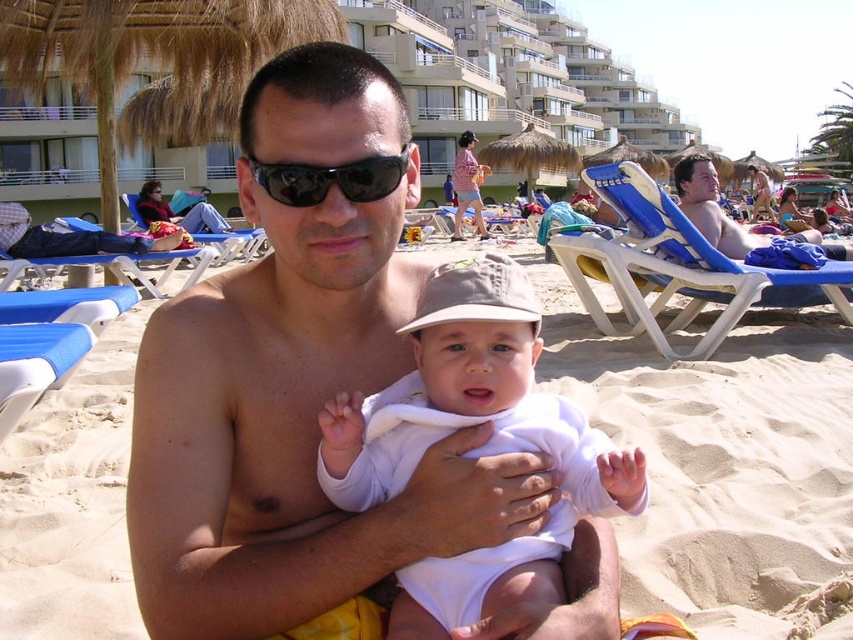
Question: Which point appears farthest from the camera in this image?

Choices:
 (A) (718, 180)
 (B) (822, 268)
 (C) (683, 468)

Answer: (A)

Question: Is matte skin man at center bigger than smooth tan skin at center?

Choices:
 (A) no
 (B) yes

Answer: (A)

Question: Does matte skin man at center have a greater width compared to sandy beach at center?

Choices:
 (A) yes
 (B) no

Answer: (A)

Question: Which point appears farthest from the camera in this image?

Choices:
 (A) (576, 499)
 (B) (358, 184)

Answer: (A)

Question: Which of the following is the farthest from the observer?

Choices:
 (A) white cotton hat at center
 (B) black reflective sunglasses at center
 (C) sandy beach at center

Answer: (C)

Question: Where is sandy beach at center located in relation to blue plastic beach chair at upper left in the image?

Choices:
 (A) below
 (B) above

Answer: (A)